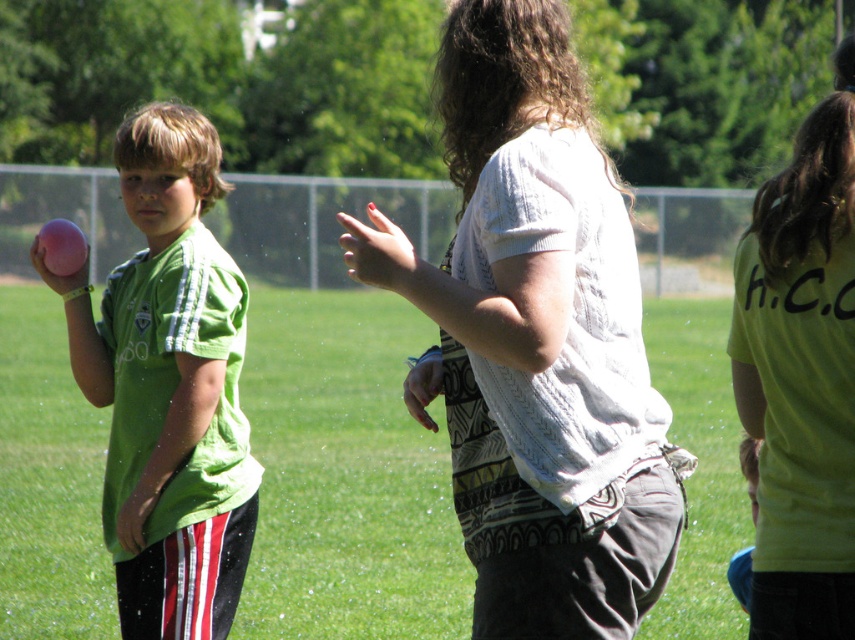
Is point (464, 90) closer to camera compared to point (96, 394)?

Yes.

Can you confirm if white knitted sweater at center is positioned below matte pink ball at left?

No.

Between point (463, 220) and point (215, 449), which one is positioned behind?

The point (215, 449) is behind.

In order to click on white knitted sweater at center in this screenshot , I will do coord(535,340).